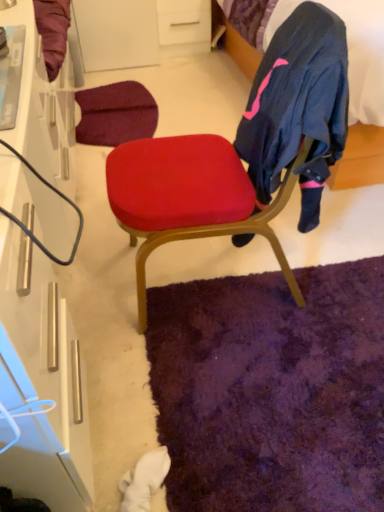
Question: From the image's perspective, relative to velvet dark blue bed at upper right, is matte red cushion at center above or below?

Choices:
 (A) below
 (B) above

Answer: (A)

Question: Is point (292, 178) positioned closer to the camera than point (240, 49)?

Choices:
 (A) closer
 (B) farther

Answer: (A)

Question: Estimate the real-world distances between objects in this image. Which object is farther from the white matte drawer at upper center?

Choices:
 (A) velvet dark blue bed at upper right
 (B) purple shaggy rug at lower center
 (C) matte red cushion at center
 (D) white glossy cabinet at left

Answer: (B)

Question: Considering the real-world distances, which object is farthest from the white matte drawer at upper center?

Choices:
 (A) velvet dark blue bed at upper right
 (B) matte red cushion at center
 (C) purple shaggy rug at lower center
 (D) white glossy cabinet at left

Answer: (C)